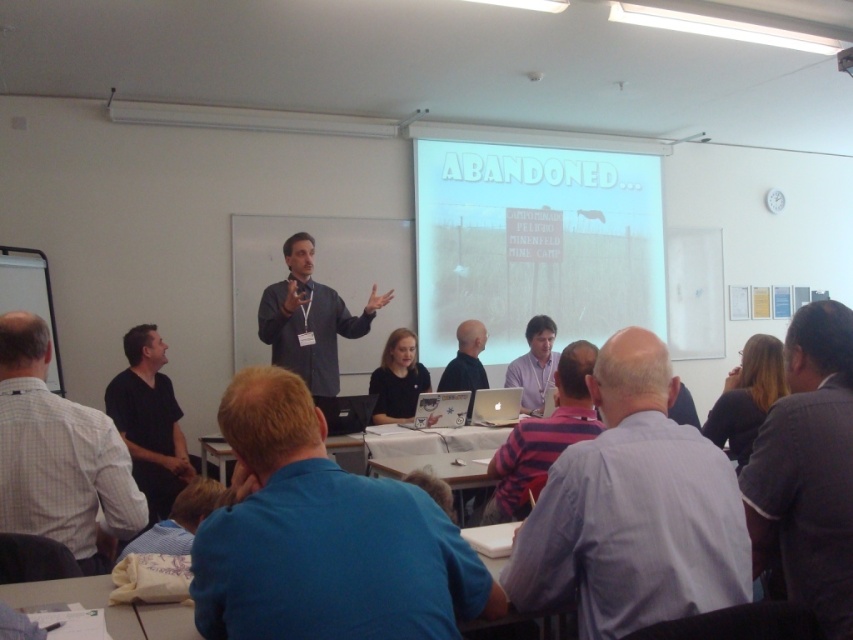
You are a student sitting in the classroom and want to locate the presenter wearing the dark gray suit at right. Where exactly should you look in the classroom?

You should look at point 0.736 on the x axis and 0.947 on the y axis to locate the dark gray suit at right.

Based on the photo, you are a photographer standing at the back of the classroom. You want to take a photo of both the gray striped shirt at center and the black matte shirt at center in the same frame. Can you fit both shirts into your camera viewfinder if your camera has a maximum horizontal field of view of 3 meters?

The gray striped shirt at center and black matte shirt at center are 3.58 meters apart. Since the distance between them exceeds the camera viewfinder maximum horizontal field of view of 3 meters, you cannot fit both shirts into the same frame.